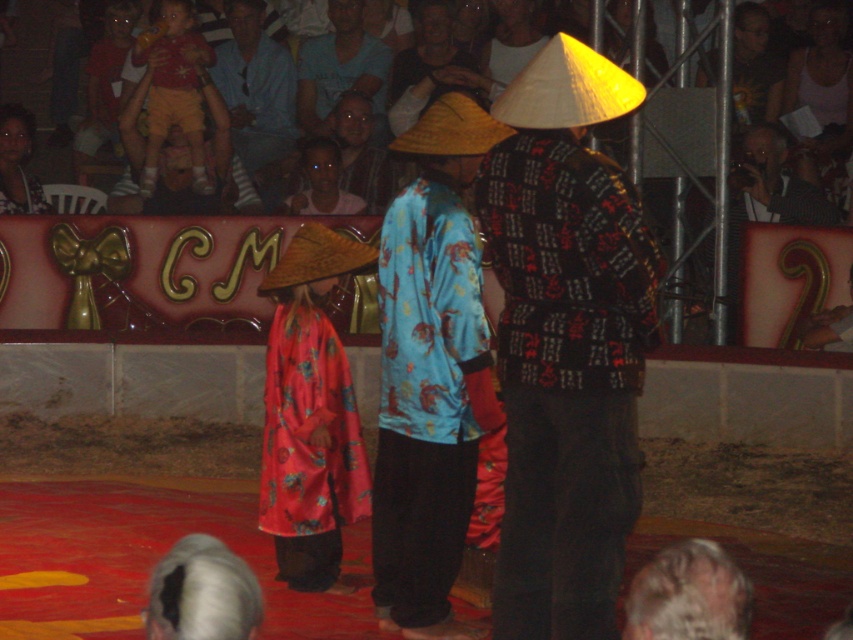
You are an event planner setting up a stage for a cultural performance. You need to ensure that all items on the stage are visible to the audience. The blue cotton shirt at center and the matte black conical hat at upper center are part of the stage setup. Which item is taller and needs to be placed in a position where it won

The blue cotton shirt at center is taller than the matte black conical hat at upper center, so it should be placed in a position where it won

You are an event organizer who needs to ensure all performers are visible to the audience. Given the patterned fabric robe at center and the gray hair at lower center, which one is more likely to be easily seen from the back row of the audience?

The patterned fabric robe at center is bigger than gray hair at lower center, so the patterned fabric robe at center would be more easily seen from the back row.

You are a photographer standing at the back of the stage. You want to capture a photo where the gray hair at lower center and the matte red robe at center are both clearly visible. Based on their positions, which object should you focus on first to ensure both are in frame?

The gray hair at lower center is located below the matte red robe at center, so you should focus on the matte red robe at center first to ensure both are in frame.